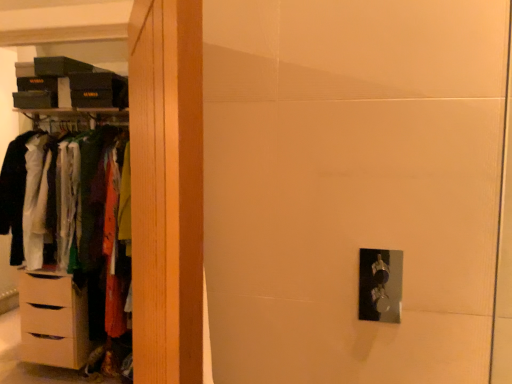
You are a GUI agent. You are given a task and a screenshot of the screen. Output one action in this format:
    pyautogui.click(x=<x>, y=<y>)
    Task: Click on the wooden wardrobe at left
    This screenshot has height=384, width=512.
    Given the screenshot: What is the action you would take?
    click(x=167, y=189)

The width and height of the screenshot is (512, 384). Find the location of `beige matte chest of drawers at left`. beige matte chest of drawers at left is located at coordinates (53, 320).

In terms of height, does matte wood dresser at left look taller or shorter compared to wooden wardrobe at left?

In the image, matte wood dresser at left appears to be taller than wooden wardrobe at left.

What's the angular difference between matte wood dresser at left and wooden wardrobe at left's facing directions?

matte wood dresser at left and wooden wardrobe at left are facing 55.8 degrees away from each other.

From a real-world perspective, who is located higher, matte wood dresser at left or wooden wardrobe at left?

wooden wardrobe at left.

Is matte wood dresser at left oriented towards wooden wardrobe at left?

No, matte wood dresser at left is not oriented towards wooden wardrobe at left.

From a real-world perspective, which is physically above, matte wood dresser at left or beige matte chest of drawers at left?

From a 3D spatial view, matte wood dresser at left is above.

Based on the photo, is matte wood dresser at left looking in the opposite direction of beige matte chest of drawers at left?

No, matte wood dresser at left's orientation is not away from beige matte chest of drawers at left.

In the scene shown: Between matte wood dresser at left and beige matte chest of drawers at left, which one has smaller size?

beige matte chest of drawers at left is smaller.

Is matte wood dresser at left to the left of beige matte chest of drawers at left from the viewer's perspective?

Incorrect, matte wood dresser at left is not on the left side of beige matte chest of drawers at left.

From the picture: Could you tell me if wooden wardrobe at left is facing beige matte chest of drawers at left?

No, wooden wardrobe at left is not facing towards beige matte chest of drawers at left.

At what (x,y) coordinates should I click in order to perform the action: click on chest of drawers on the left side of wooden wardrobe at left. Please return your answer as a coordinate pair (x, y). This screenshot has height=384, width=512. Looking at the image, I should click on (53, 320).

From the image's perspective, does wooden wardrobe at left appear higher than matte wood dresser at left?

No, from the image's perspective, wooden wardrobe at left is not on top of matte wood dresser at left.

Considering the sizes of wooden wardrobe at left and matte wood dresser at left in the image, is wooden wardrobe at left wider or thinner than matte wood dresser at left?

In the image, wooden wardrobe at left appears to be more narrow than matte wood dresser at left.

Is beige matte chest of drawers at left turned away from wooden wardrobe at left?

No.

Which of these two, beige matte chest of drawers at left or wooden wardrobe at left, is smaller?

wooden wardrobe at left.

Would you say beige matte chest of drawers at left contains wooden wardrobe at left?

Actually, wooden wardrobe at left is outside beige matte chest of drawers at left.

In order to click on chest of drawers on the left of matte wood dresser at left in this screenshot , I will do `click(53, 320)`.

From the image's perspective, who appears lower, beige matte chest of drawers at left or matte wood dresser at left?

beige matte chest of drawers at left.

Considering the sizes of objects beige matte chest of drawers at left and matte wood dresser at left in the image provided, who is taller, beige matte chest of drawers at left or matte wood dresser at left?

matte wood dresser at left is taller.

Does beige matte chest of drawers at left have a smaller size compared to matte wood dresser at left?

A: Correct, beige matte chest of drawers at left occupies less space than matte wood dresser at left.

This screenshot has width=512, height=384. In order to click on dresser on the left of wooden wardrobe at left in this screenshot , I will do `click(56, 320)`.

This screenshot has height=384, width=512. Identify the location of dresser above the beige matte chest of drawers at left (from a real-world perspective). (56, 320).

Which object lies nearer to the anchor point matte wood dresser at left, wooden wardrobe at left or beige matte chest of drawers at left?

beige matte chest of drawers at left.

Estimate the real-world distances between objects in this image. Which object is further from beige matte chest of drawers at left, wooden wardrobe at left or matte wood dresser at left?

wooden wardrobe at left lies further to beige matte chest of drawers at left than the other object.

Which object lies nearer to the anchor point wooden wardrobe at left, matte wood dresser at left or beige matte chest of drawers at left?

The object closer to wooden wardrobe at left is beige matte chest of drawers at left.

Looking at the image, which one is located closer to matte wood dresser at left, beige matte chest of drawers at left or wooden wardrobe at left?

Based on the image, beige matte chest of drawers at left appears to be nearer to matte wood dresser at left.

From the image, which object appears to be nearer to wooden wardrobe at left, beige matte chest of drawers at left or matte wood dresser at left?

beige matte chest of drawers at left is positioned closer to the anchor wooden wardrobe at left.

Considering their positions, is matte wood dresser at left positioned further to beige matte chest of drawers at left than wooden wardrobe at left?

wooden wardrobe at left is further to beige matte chest of drawers at left.

Image resolution: width=512 pixels, height=384 pixels. In order to click on dresser between wooden wardrobe at left and beige matte chest of drawers at left along the z-axis in this screenshot , I will do `click(56, 320)`.